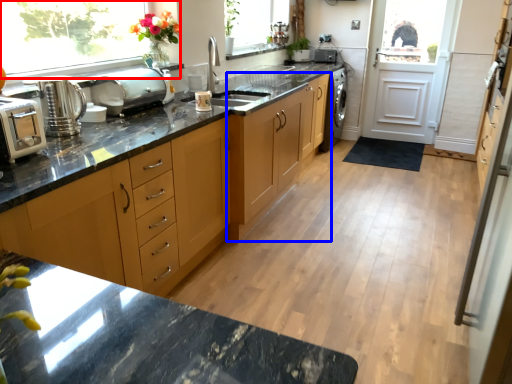
Question: Which object is further to the camera taking this photo, window (highlighted by a red box) or cabinetry (highlighted by a blue box)?

Choices:
 (A) window
 (B) cabinetry

Answer: (B)